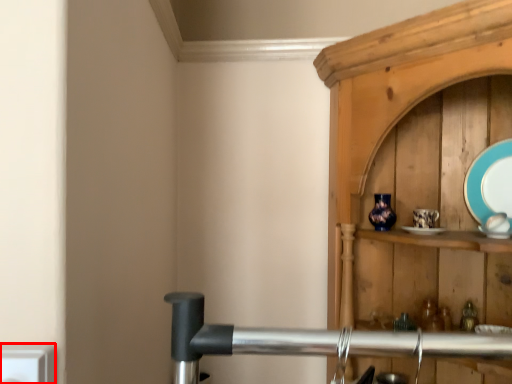
Question: From the image's perspective, what is the correct spatial positioning of electric outlet (annotated by the red box) in reference to platter?

Choices:
 (A) above
 (B) below

Answer: (B)